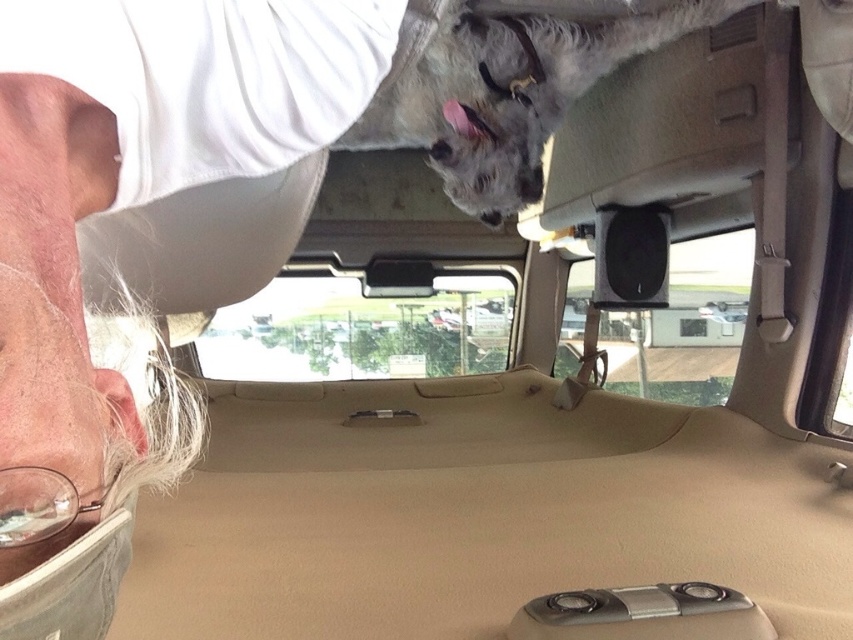
You are a passenger in the van and want to hand a treat to the white fluffy dog at upper center. To do so, do you need to move the gray fabric cap at upper left out of the way?

The gray fabric cap at upper left is positioned on the left side of white fluffy dog at upper center, so you would need to move the gray fabric cap at upper left to access the white fluffy dog at upper center.

You are inside a car and want to see the road ahead. You have a gray fabric cap at upper left and a transparent glass car window at center. Which object allows you to see the road better?

The transparent glass car window at center allows you to see the road better because it is a window designed for viewing outside, while the gray fabric cap at upper left is an object blocking the view.

You are a passenger in the vehicle and want to see the white fluffy dog at upper center through the transparent glass car window at center. Can the dog fit entirely within your view through the window?

The white fluffy dog at upper center is not as tall as the transparent glass car window at center, so yes, the dog can fit entirely within your view through the window.